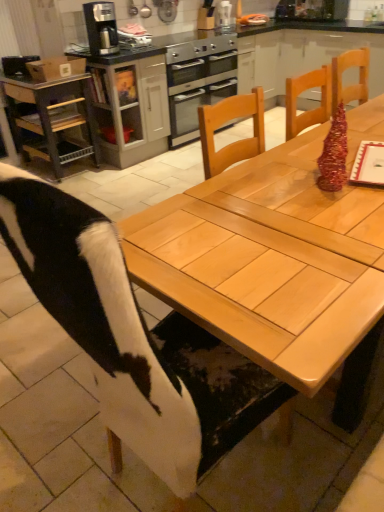
Image resolution: width=384 pixels, height=512 pixels. In order to click on free point below metallic silver toaster at upper center (from a real-world perspective) in this screenshot , I will do `click(224, 28)`.